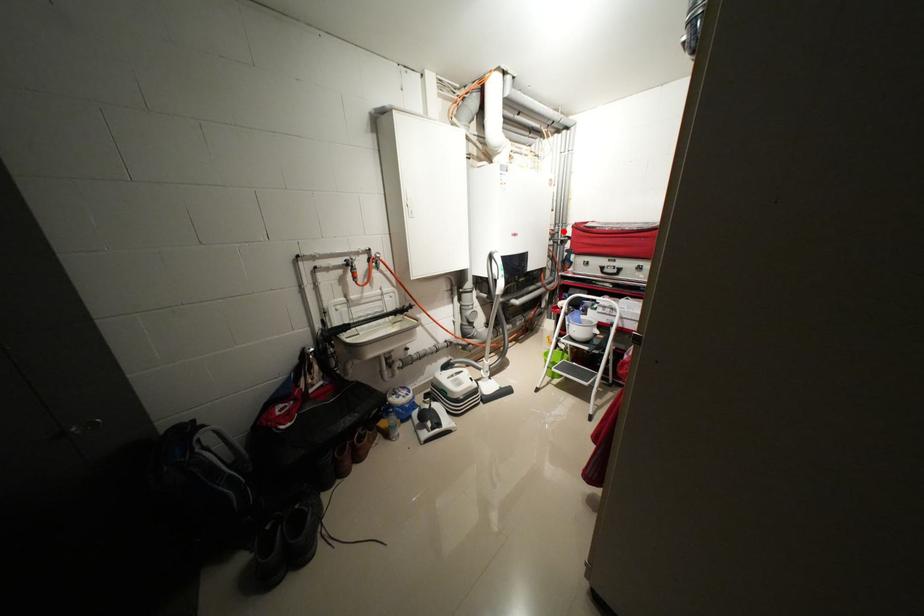
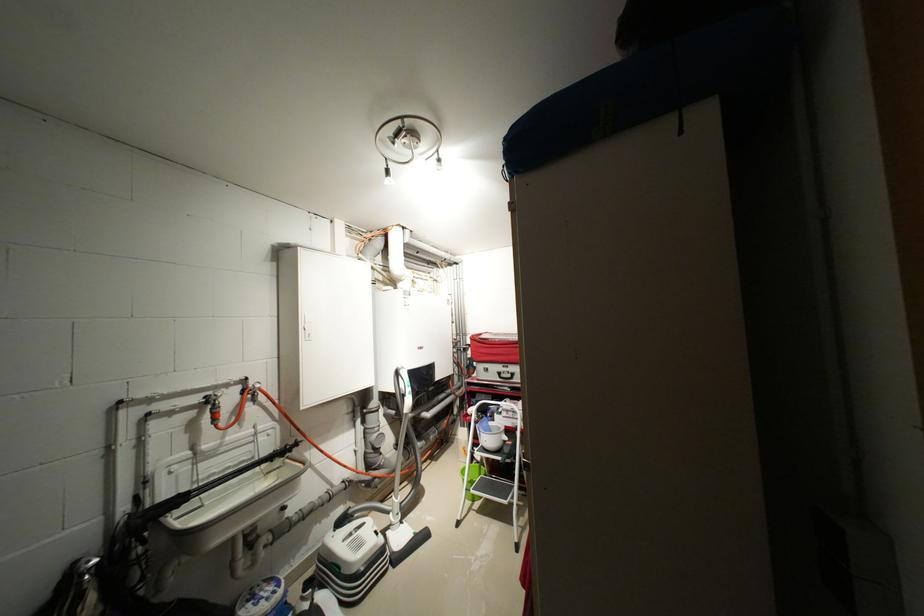
In the second image, find the point that corresponds to the highlighted location in the first image.

(466, 341)